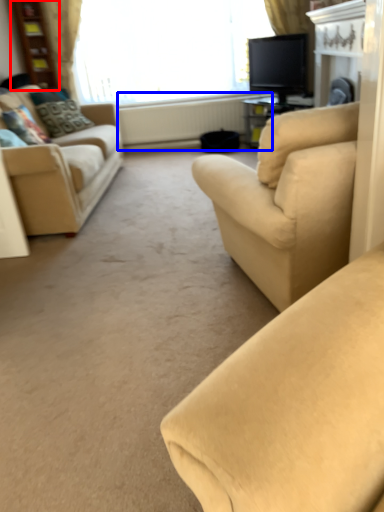
Question: Among these objects, which one is farthest to the camera, bookshelf (highlighted by a red box) or radiator (highlighted by a blue box)?

Choices:
 (A) bookshelf
 (B) radiator

Answer: (B)